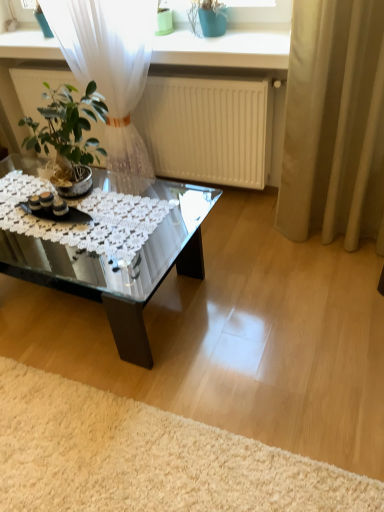
Question: Can you confirm if transparent glass coffee table at center is thinner than beige fabric curtain at right?

Choices:
 (A) yes
 (B) no

Answer: (B)

Question: Would you say transparent glass coffee table at center contains beige fabric curtain at right?

Choices:
 (A) no
 (B) yes

Answer: (A)

Question: Considering the relative sizes of transparent glass coffee table at center and beige fabric curtain at right in the image provided, is transparent glass coffee table at center wider than beige fabric curtain at right?

Choices:
 (A) no
 (B) yes

Answer: (B)

Question: From a real-world perspective, is transparent glass coffee table at center located higher than beige fabric curtain at right?

Choices:
 (A) yes
 (B) no

Answer: (B)

Question: Can you confirm if transparent glass coffee table at center is bigger than beige fabric curtain at right?

Choices:
 (A) yes
 (B) no

Answer: (A)

Question: From a real-world perspective, relative to white shaggy rug at lower left, is white matte radiator at upper center vertically above or below?

Choices:
 (A) below
 (B) above

Answer: (B)

Question: In terms of height, does white matte radiator at upper center look taller or shorter compared to white shaggy rug at lower left?

Choices:
 (A) short
 (B) tall

Answer: (B)

Question: From the image's perspective, is white matte radiator at upper center positioned above or below white shaggy rug at lower left?

Choices:
 (A) below
 (B) above

Answer: (B)

Question: Do you think white matte radiator at upper center is within white shaggy rug at lower left, or outside of it?

Choices:
 (A) inside
 (B) outside

Answer: (B)

Question: Is point (236, 88) positioned closer to the camera than point (309, 96)?

Choices:
 (A) farther
 (B) closer

Answer: (A)

Question: From the image's perspective, is white matte radiator at upper center positioned above or below beige fabric curtain at right?

Choices:
 (A) below
 (B) above

Answer: (B)

Question: In the image, is white matte radiator at upper center positioned in front of or behind beige fabric curtain at right?

Choices:
 (A) front
 (B) behind

Answer: (B)

Question: Which is correct: white matte radiator at upper center is inside beige fabric curtain at right, or outside of it?

Choices:
 (A) outside
 (B) inside

Answer: (A)

Question: In terms of width, does white shaggy rug at lower left look wider or thinner when compared to white matte radiator at upper center?

Choices:
 (A) thin
 (B) wide

Answer: (B)

Question: Is white shaggy rug at lower left in front of or behind white matte radiator at upper center in the image?

Choices:
 (A) behind
 (B) front

Answer: (B)